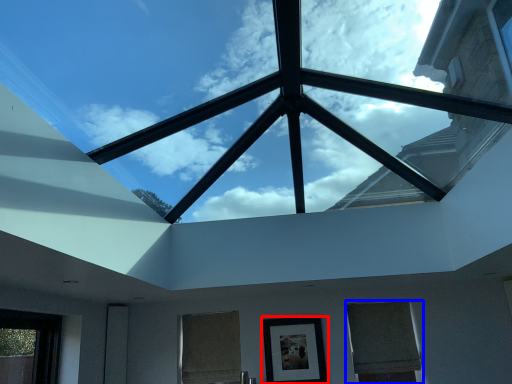
Question: Which object is further to the camera taking this photo, picture frame (highlighted by a red box) or window (highlighted by a blue box)?

Choices:
 (A) picture frame
 (B) window

Answer: (B)